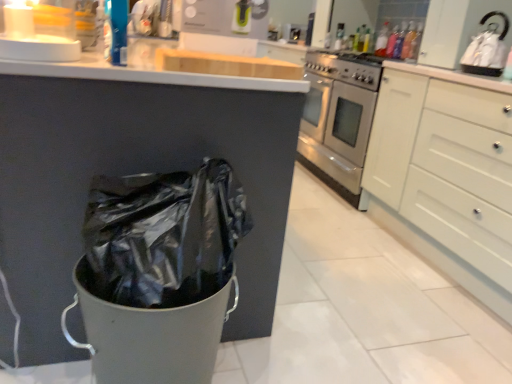
What is the approximate height of matte white sink at upper center?

The height of matte white sink at upper center is 7.02 inches.

What do you see at coordinates (487, 49) in the screenshot?
I see `white glossy kettle at upper right` at bounding box center [487, 49].

At what (x,y) coordinates should I click in order to perform the action: click on white matte cabinet at right. Please return your answer as a coordinate pair (x, y). Looking at the image, I should click on (447, 176).

From the picture: Is translucent plastic bottle at upper right, the first bottle viewed from the right, located outside translucent plastic bottle at upper right, arranged as the first bottle when viewed from the left?

translucent plastic bottle at upper right, the first bottle viewed from the right, is positioned outside translucent plastic bottle at upper right, arranged as the first bottle when viewed from the left.

From the picture: Which is less distant, (403,43) or (378,41)?

Point (403,43) appears to be closer to the viewer than point (378,41).

At what (x,y) coordinates should I click in order to perform the action: click on bottle on the right of translucent plastic bottle at upper right, arranged as the first bottle when viewed from the left. Please return your answer as a coordinate pair (x, y). The height and width of the screenshot is (384, 512). Looking at the image, I should click on (409, 41).

Considering the relative positions of white glossy kettle at upper right and translucent plastic bottle at upper right, positioned as the 1th bottle in back-to-front order, in the image provided, is white glossy kettle at upper right to the right of translucent plastic bottle at upper right, positioned as the 1th bottle in back-to-front order, from the viewer's perspective?

Correct, you'll find white glossy kettle at upper right to the right of translucent plastic bottle at upper right, positioned as the 1th bottle in back-to-front order.

Can you confirm if white glossy kettle at upper right is bigger than translucent plastic bottle at upper right, positioned as the 1th bottle in back-to-front order?

Yes.

Does white glossy kettle at upper right touch translucent plastic bottle at upper right, which ranks as the second bottle in right-to-left order?

No, white glossy kettle at upper right is not touching translucent plastic bottle at upper right, which ranks as the second bottle in right-to-left order.

Does white glossy kettle at upper right contain translucent plastic bottle at upper right, positioned as the 1th bottle in back-to-front order?

Definitely not — translucent plastic bottle at upper right, positioned as the 1th bottle in back-to-front order, is not inside white glossy kettle at upper right.

Is translucent plastic bottle at upper right, which is counted as the second bottle, starting from the front, spatially inside white matte cabinet at right, or outside of it?

translucent plastic bottle at upper right, which is counted as the second bottle, starting from the front, lies outside white matte cabinet at right.

Does translucent plastic bottle at upper right, positioned as the 1th bottle in back-to-front order, have a lesser height compared to white matte cabinet at right?

Yes.

Does point (377, 38) come behind point (397, 181)?

Yes, it is.

Can you tell me how much translucent plastic bottle at upper right, arranged as the first bottle when viewed from the left, and white matte cabinet at right differ in facing direction?

0.202 degrees.

Can you tell me how much white glossy kettle at upper right and translucent plastic bottle at upper right, the second bottle positioned from the back, differ in facing direction?

The angle between the facing direction of white glossy kettle at upper right and the facing direction of translucent plastic bottle at upper right, the second bottle positioned from the back, is 0.0813 degrees.

Between white glossy kettle at upper right and translucent plastic bottle at upper right, acting as the 2th bottle starting from the left, which one has larger size?

Bigger between the two is white glossy kettle at upper right.

Which is behind, point (472, 49) or point (404, 53)?

The point (404, 53) is more distant.

Is white matte cabinet at right at the left side of white glossy kettle at upper right?

Incorrect, white matte cabinet at right is not on the left side of white glossy kettle at upper right.

Can we say white matte cabinet at right lies outside white glossy kettle at upper right?

Indeed, white matte cabinet at right is completely outside white glossy kettle at upper right.

From the image's perspective, is white matte cabinet at right below white glossy kettle at upper right?

Yes, from the image's perspective, white matte cabinet at right is below white glossy kettle at upper right.

Considering the relative sizes of white matte cabinet at right and white glossy kettle at upper right in the image provided, is white matte cabinet at right taller than white glossy kettle at upper right?

Indeed, white matte cabinet at right has a greater height compared to white glossy kettle at upper right.

From the image's perspective, which one is positioned lower, translucent plastic bottle at upper right, the second bottle positioned from the back, or matte white sink at upper center?

translucent plastic bottle at upper right, the second bottle positioned from the back, appears lower in the image.

Where is `bottle that is the 1st one above the matte white sink at upper center (from a real-world perspective)`? The width and height of the screenshot is (512, 384). bottle that is the 1st one above the matte white sink at upper center (from a real-world perspective) is located at coordinates point(409,41).

Considering the points (475, 61) and (419, 160), which point is behind, point (475, 61) or point (419, 160)?

Point (419, 160)

From the image's perspective, would you say white glossy kettle at upper right is positioned over white matte cabinet at right?

Correct, white glossy kettle at upper right appears higher than white matte cabinet at right in the image.

How different are the orientations of white glossy kettle at upper right and white matte cabinet at right in degrees?

The angular difference between white glossy kettle at upper right and white matte cabinet at right is 0.0782 degrees.

Where is `cabinetry lying in front of the white glossy kettle at upper right`? The height and width of the screenshot is (384, 512). cabinetry lying in front of the white glossy kettle at upper right is located at coordinates (447, 176).

Identify the location of bottle that is above the translucent plastic bottle at upper right, the first bottle viewed from the right (from a real-world perspective). The width and height of the screenshot is (512, 384). (382, 40).

Where is `appliance in front of the translucent plastic bottle at upper right, which ranks as the second bottle in right-to-left order`? This screenshot has height=384, width=512. appliance in front of the translucent plastic bottle at upper right, which ranks as the second bottle in right-to-left order is located at coordinates (487, 49).

Considering their positions, is matte white sink at upper center positioned further to white matte cabinet at right than white glossy kettle at upper right?

matte white sink at upper center is positioned further to the anchor white matte cabinet at right.

Looking at the image, which one is located closer to translucent plastic bottle at upper right, positioned as the 1th bottle in back-to-front order, matte white sink at upper center or translucent plastic bottle at upper right, the first bottle positioned from the front?

translucent plastic bottle at upper right, the first bottle positioned from the front, is positioned closer to the anchor translucent plastic bottle at upper right, positioned as the 1th bottle in back-to-front order.

Which object lies further to the anchor point white matte cabinet at right, translucent plastic bottle at upper right, the second bottle positioned from the back, or white glossy kettle at upper right?

The object further to white matte cabinet at right is translucent plastic bottle at upper right, the second bottle positioned from the back.

Which object lies further to the anchor point matte white sink at upper center, translucent plastic bottle at upper right, arranged as the first bottle when viewed from the left, or white matte cabinet at right?

white matte cabinet at right.

Looking at the image, which one is located further to translucent plastic bottle at upper right, the second bottle positioned from the back, white matte cabinet at right or white glossy kettle at upper right?

Among the two, white matte cabinet at right is located further to translucent plastic bottle at upper right, the second bottle positioned from the back.

Looking at the image, which one is located closer to translucent plastic bottle at upper right, the first bottle positioned from the front, white matte cabinet at right or matte white sink at upper center?

matte white sink at upper center.

From the image, which object appears to be farther from translucent plastic bottle at upper right, the second bottle positioned from the back, matte white sink at upper center or white matte cabinet at right?

Among the two, white matte cabinet at right is located further to translucent plastic bottle at upper right, the second bottle positioned from the back.

From the image, which object appears to be farther from matte white sink at upper center, translucent plastic bottle at upper right, which is counted as the second bottle, starting from the front, or translucent plastic bottle at upper right, the first bottle positioned from the front?

Among the two, translucent plastic bottle at upper right, the first bottle positioned from the front, is located further to matte white sink at upper center.

The height and width of the screenshot is (384, 512). I want to click on appliance between white matte cabinet at right and translucent plastic bottle at upper right, positioned as the 1th bottle in back-to-front order, from front to back, so click(x=487, y=49).

What are the coordinates of `bottle between translucent plastic bottle at upper right, the first bottle positioned from the front, and matte white sink at upper center, along the z-axis` in the screenshot? It's located at (382, 40).

This screenshot has height=384, width=512. Identify the location of appliance between white matte cabinet at right and translucent plastic bottle at upper right, the second bottle positioned from the back, in the front-back direction. (487, 49).

At what (x,y) coordinates should I click in order to perform the action: click on bottle between white matte cabinet at right and translucent plastic bottle at upper right, which ranks as the second bottle in right-to-left order, along the z-axis. Please return your answer as a coordinate pair (x, y). The height and width of the screenshot is (384, 512). Looking at the image, I should click on (409, 41).